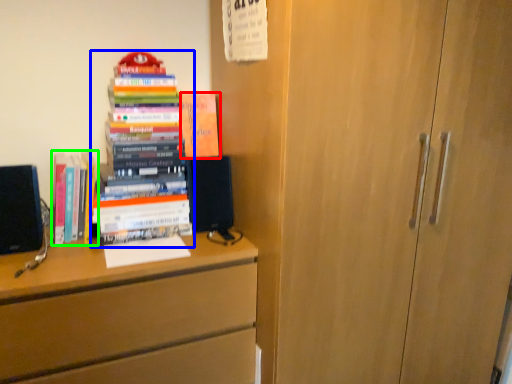
Question: Which is nearer to the book (highlighted by a red box)? book (highlighted by a blue box) or book (highlighted by a green box).

Choices:
 (A) book
 (B) book

Answer: (A)